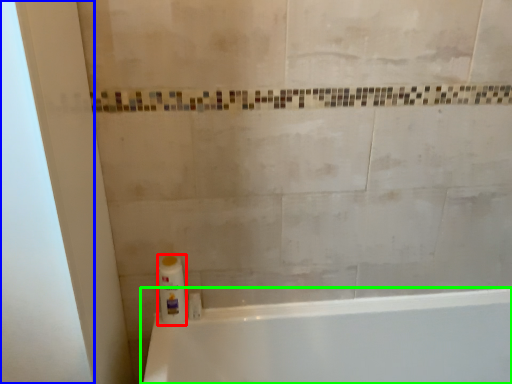
Question: Which is farther away from cleaning product (highlighted by a red box)? screen door (highlighted by a blue box) or bathtub (highlighted by a green box)?

Choices:
 (A) screen door
 (B) bathtub

Answer: (B)